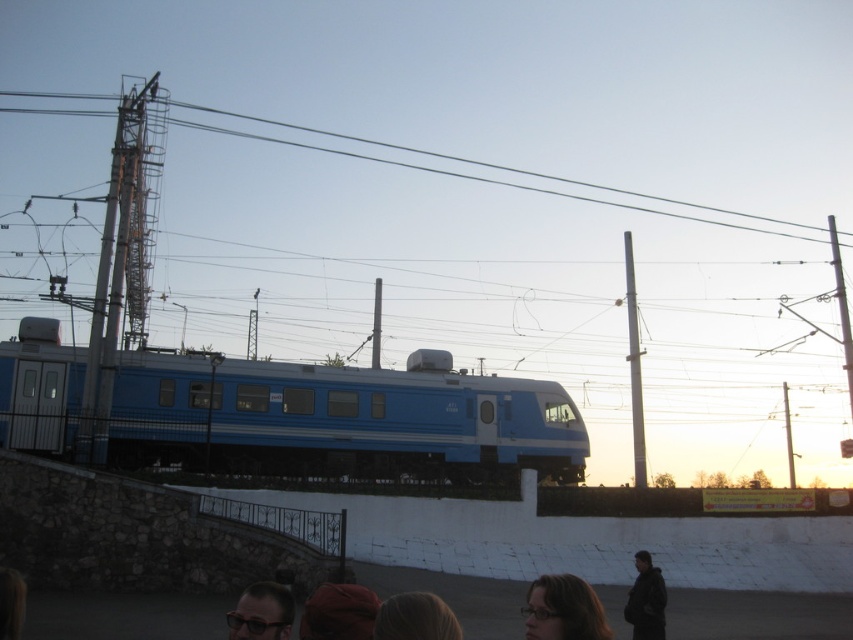
You are a pedestrian standing at the dark gray jacket at lower right position. The blue glossy train at center is approaching you. If the train is moving at 15 km per hour, how many seconds do you have before the train reaches you?

The distance between the blue glossy train at center and dark gray jacket at lower right is 28.39 meters. Converting the train speed from 15 km per hour to meters per second gives approximately 4.17 m per second. Dividing the distance by the speed yields 28.39 divided by 4.17 equals approximately 6.81 seconds. Therefore, you have roughly 7 seconds before the train reaches you.

You are an engineer inspecting the railway infrastructure. You notice the blue glossy train at center and the metallic wire at upper center. Which object takes up more area in the image?

The metallic wire at upper center occupies more space than the blue glossy train at center.

You are standing at the railway station and want to take a photo of the train. You notice two points marked in the scene. Which point, point (368, 612) or point (267, 596), is closer to you when you take the photo?

Point (368, 612) is closer to the camera than point (267, 596), so it will appear closer to you in the photo.